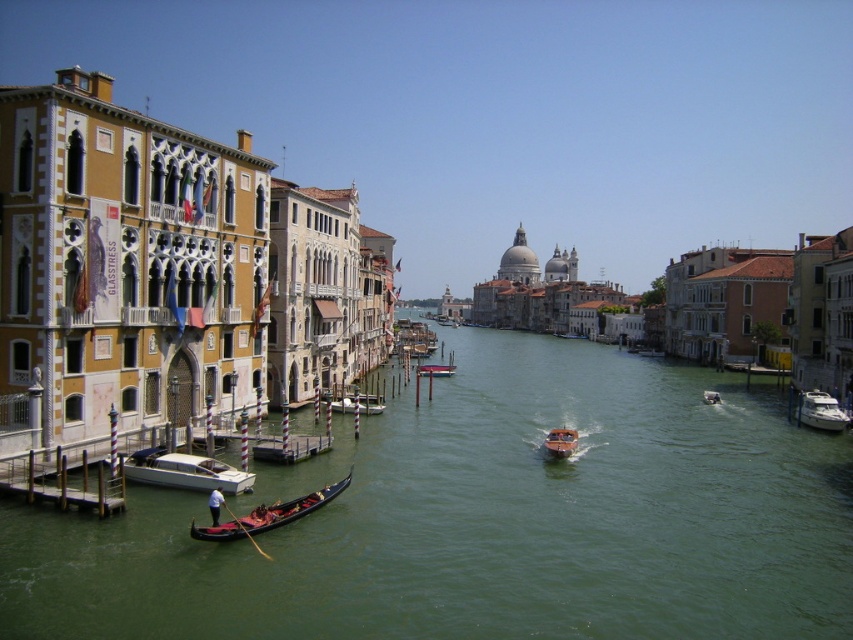
You are standing on a bridge overlooking the canal and see two points marked on the water. The first point is at coordinates point (802, 436) and the second point is at point (160, 467). If you were to throw a small floating object into the water, which point would it reach first if it drifts downstream with the current?

The floating object would reach point (160, 467) first because point (802, 436) is behind it, meaning the current would carry the object towards the point that is further downstream.

You are a tourist standing on the canal bridge and want to take a photo of the white glossy motorboat at lower left and the green water at center. Which object is wider in the scene?

The green water at center is wider than the white glossy motorboat at lower left.

You are standing at the edge of the canal in Venice and see two points marked on the water. The first point is at coordinates point (352, 403) and the second is at point (425, 374). Which point is closer to your current position?

Point (352, 403) is closer to the camera than point (425, 374), so the first point is closer to your current position.